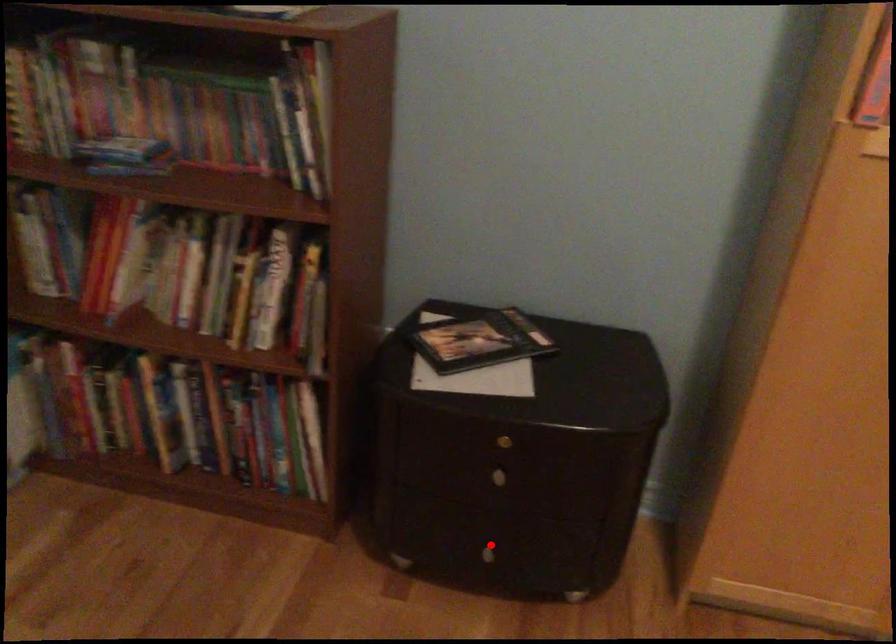
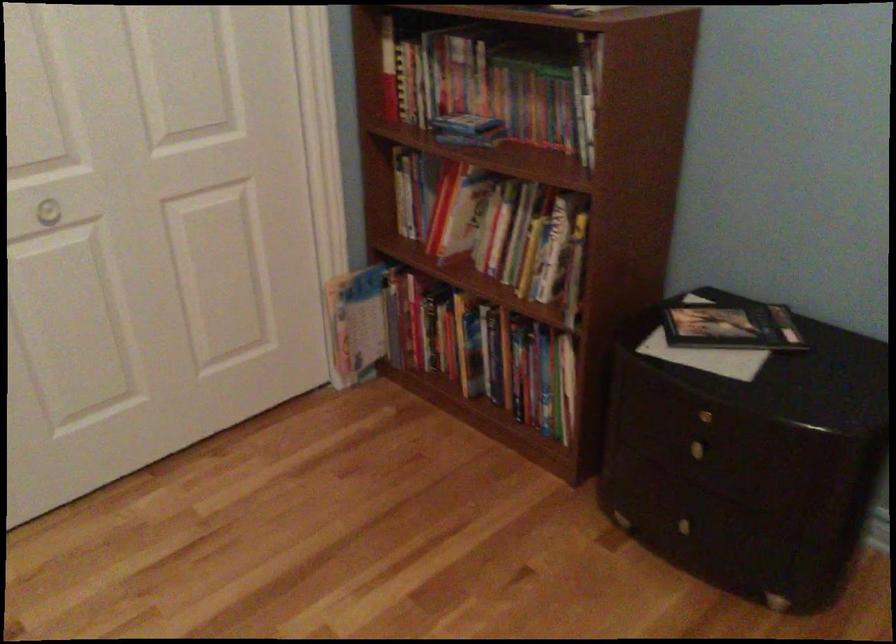
Find the pixel in the second image that matches the highlighted location in the first image.

(690, 518)